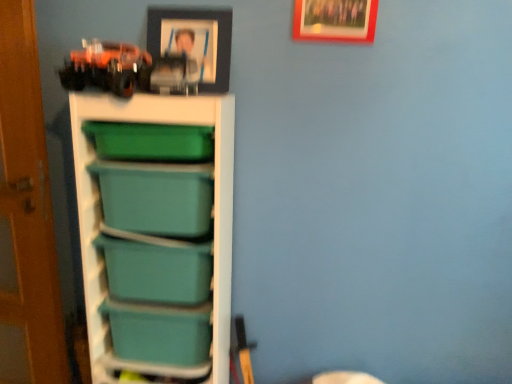
Question: Is teal plastic storage bin at center, marked as the 1th box in a top-to-bottom arrangement, to the right of wooden picture frame at upper center, which ranks as the first picture frame in right-to-left order, from the viewer's perspective?

Choices:
 (A) yes
 (B) no

Answer: (B)

Question: From a real-world perspective, is teal plastic storage bin at center, marked as the 1th box in a top-to-bottom arrangement, physically below wooden picture frame at upper center, which ranks as the second picture frame in left-to-right order?

Choices:
 (A) yes
 (B) no

Answer: (A)

Question: Is teal plastic storage bin at center, which is the 2th box in bottom-to-top order, smaller than wooden picture frame at upper center, which ranks as the second picture frame in left-to-right order?

Choices:
 (A) no
 (B) yes

Answer: (A)

Question: Considering the relative sizes of teal plastic storage bin at center, which is the 2th box in bottom-to-top order, and wooden picture frame at upper center, which ranks as the first picture frame in right-to-left order, in the image provided, is teal plastic storage bin at center, which is the 2th box in bottom-to-top order, bigger than wooden picture frame at upper center, which ranks as the first picture frame in right-to-left order,?

Choices:
 (A) no
 (B) yes

Answer: (B)

Question: Does teal plastic storage bin at center, which is the 2th box in bottom-to-top order, have a greater width compared to wooden picture frame at upper center, which ranks as the second picture frame in left-to-right order?

Choices:
 (A) yes
 (B) no

Answer: (A)

Question: Is teal plastic storage bin at center, marked as the 1th box in a top-to-bottom arrangement, aimed at wooden picture frame at upper center, which ranks as the second picture frame in left-to-right order?

Choices:
 (A) no
 (B) yes

Answer: (A)

Question: Can you confirm if teal plastic storage bin at center, the 2th box in the top-to-bottom sequence, is thinner than wooden picture frame at upper center, which ranks as the first picture frame in right-to-left order?

Choices:
 (A) no
 (B) yes

Answer: (A)

Question: Is teal plastic storage bin at center, placed as the first box when sorted from bottom to top, not near wooden picture frame at upper center, which ranks as the first picture frame in right-to-left order?

Choices:
 (A) no
 (B) yes

Answer: (B)

Question: From a real-world perspective, is teal plastic storage bin at center, placed as the first box when sorted from bottom to top, located beneath wooden picture frame at upper center, which ranks as the second picture frame in left-to-right order?

Choices:
 (A) yes
 (B) no

Answer: (A)

Question: Is teal plastic storage bin at center, placed as the first box when sorted from bottom to top, taller than wooden picture frame at upper center, which ranks as the first picture frame in right-to-left order?

Choices:
 (A) yes
 (B) no

Answer: (B)

Question: Does teal plastic storage bin at center, placed as the first box when sorted from bottom to top, appear on the left side of wooden picture frame at upper center, which ranks as the first picture frame in right-to-left order?

Choices:
 (A) yes
 (B) no

Answer: (A)

Question: Is teal plastic storage bin at center, placed as the first box when sorted from bottom to top, bigger than wooden picture frame at upper center, which ranks as the second picture frame in left-to-right order?

Choices:
 (A) no
 (B) yes

Answer: (B)

Question: Is teal plastic storage at left further to the viewer compared to matte black picture frame at upper center, the 1th picture frame in the left-to-right sequence?

Choices:
 (A) no
 (B) yes

Answer: (A)